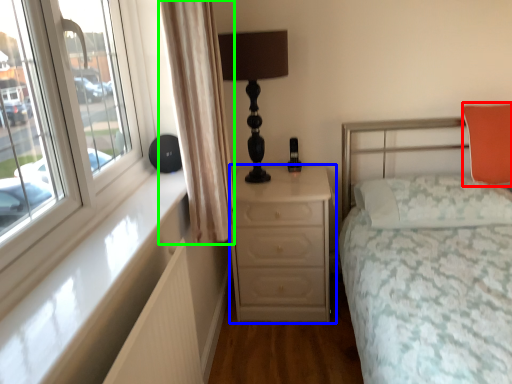
Question: Considering the real-world distances, which object is farthest from pillow (highlighted by a red box)? chest of drawers (highlighted by a blue box) or curtain (highlighted by a green box)?

Choices:
 (A) chest of drawers
 (B) curtain

Answer: (B)